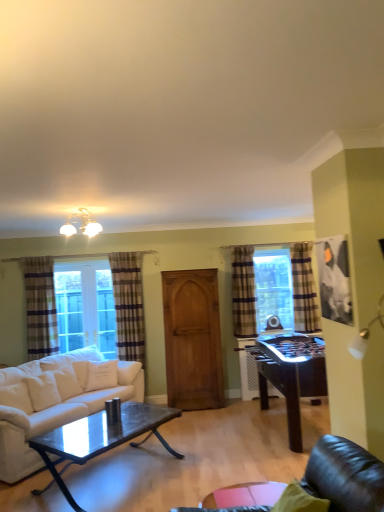
Question: Is plaid fabric curtain at left, positioned as the second curtain in left-to-right order, wider than wooden armoire at center?

Choices:
 (A) yes
 (B) no

Answer: (B)

Question: Is plaid fabric curtain at left, the third curtain in the right-to-left sequence, at the left side of wooden armoire at center?

Choices:
 (A) yes
 (B) no

Answer: (A)

Question: Is plaid fabric curtain at left, the third curtain in the right-to-left sequence, closer to the viewer compared to wooden armoire at center?

Choices:
 (A) yes
 (B) no

Answer: (B)

Question: Is plaid fabric curtain at left, the third curtain in the right-to-left sequence, positioned with its back to wooden armoire at center?

Choices:
 (A) yes
 (B) no

Answer: (B)

Question: Can you see plaid fabric curtain at left, the third curtain in the right-to-left sequence, touching wooden armoire at center?

Choices:
 (A) yes
 (B) no

Answer: (B)

Question: Considering the positions of white fabric couch at lower left and plaid fabric curtain at left, the third curtain in the right-to-left sequence, in the image, is white fabric couch at lower left wider or thinner than plaid fabric curtain at left, the third curtain in the right-to-left sequence,?

Choices:
 (A) thin
 (B) wide

Answer: (B)

Question: In terms of size, does white fabric couch at lower left appear bigger or smaller than plaid fabric curtain at left, the third curtain in the right-to-left sequence?

Choices:
 (A) big
 (B) small

Answer: (A)

Question: From their relative heights in the image, would you say white fabric couch at lower left is taller or shorter than plaid fabric curtain at left, positioned as the second curtain in left-to-right order?

Choices:
 (A) short
 (B) tall

Answer: (A)

Question: Would you say white fabric couch at lower left is to the left or to the right of plaid fabric curtain at left, positioned as the second curtain in left-to-right order, in the picture?

Choices:
 (A) left
 (B) right

Answer: (A)

Question: Is plaid fabric curtain at left, arranged as the 1th curtain when viewed from the left, taller or shorter than transparent glass table at lower center?

Choices:
 (A) tall
 (B) short

Answer: (A)

Question: Considering their positions, is plaid fabric curtain at left, the 4th curtain from the right, located in front of or behind transparent glass table at lower center?

Choices:
 (A) front
 (B) behind

Answer: (B)

Question: Is plaid fabric curtain at left, the 4th curtain from the right, inside or outside of transparent glass table at lower center?

Choices:
 (A) inside
 (B) outside

Answer: (B)

Question: Does point (33, 355) appear closer or farther from the camera than point (278, 497)?

Choices:
 (A) closer
 (B) farther

Answer: (B)

Question: In the image, is plaid fabric curtain at center, the 2th curtain when ordered from right to left, on the left side or the right side of transparent glass table at lower center?

Choices:
 (A) left
 (B) right

Answer: (B)

Question: Is plaid fabric curtain at center, the 2th curtain when ordered from right to left, inside or outside of transparent glass table at lower center?

Choices:
 (A) outside
 (B) inside

Answer: (A)